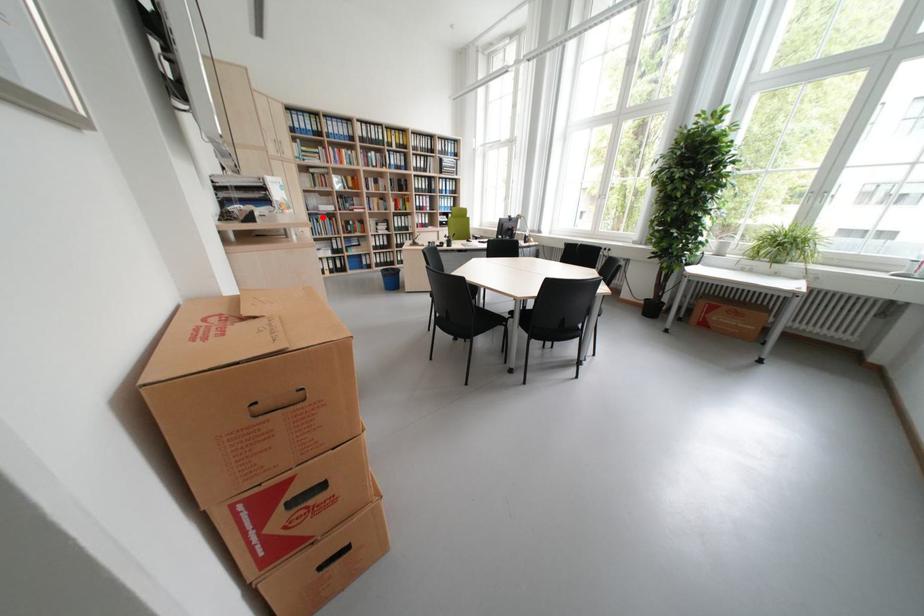
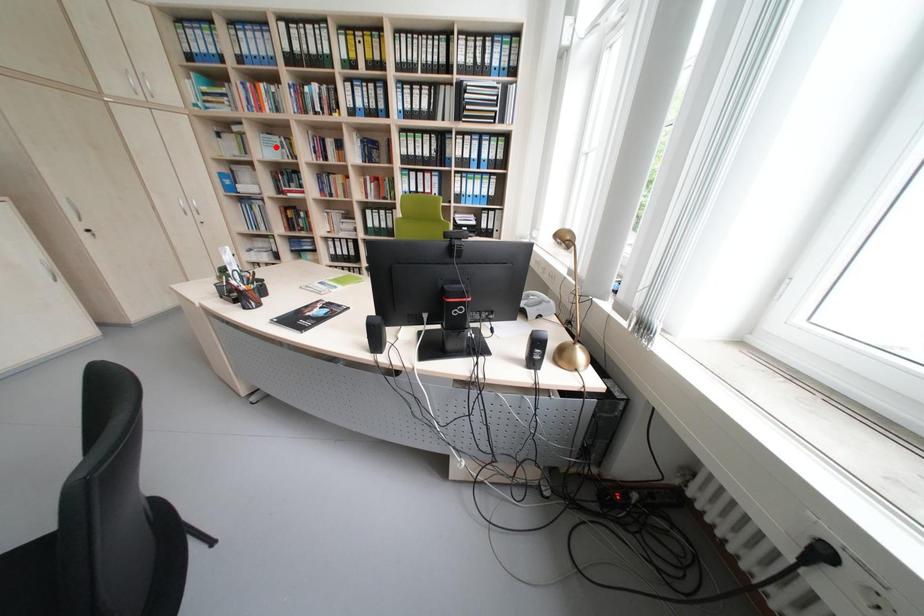
I am providing you with two images of the same scene from different viewpoints. A red point is marked on the first image and another point is marked on the second image. Do the highlighted points in image1 and image2 indicate the same real-world spot?

No